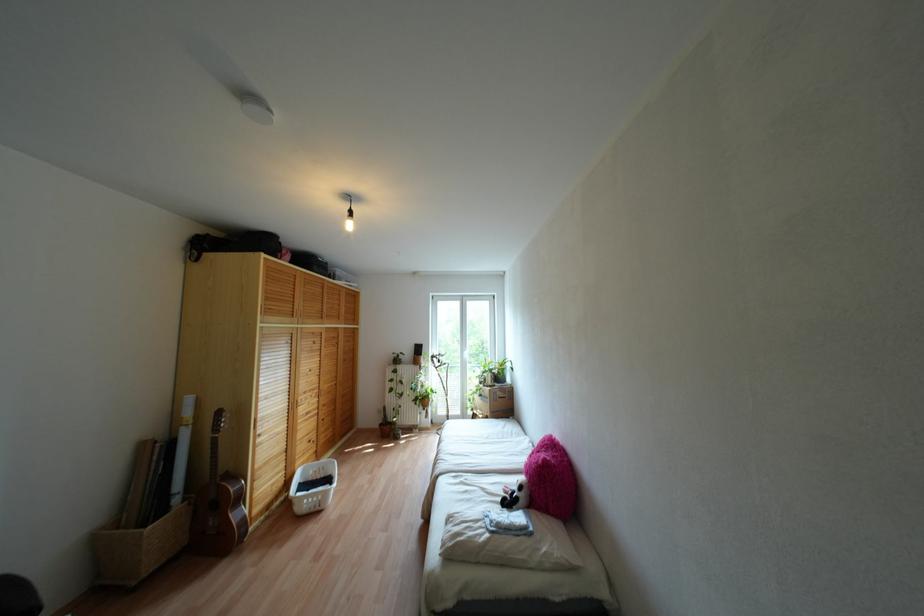
Image resolution: width=924 pixels, height=616 pixels. Describe the element at coordinates (312, 485) in the screenshot. I see `the white laundry basket` at that location.